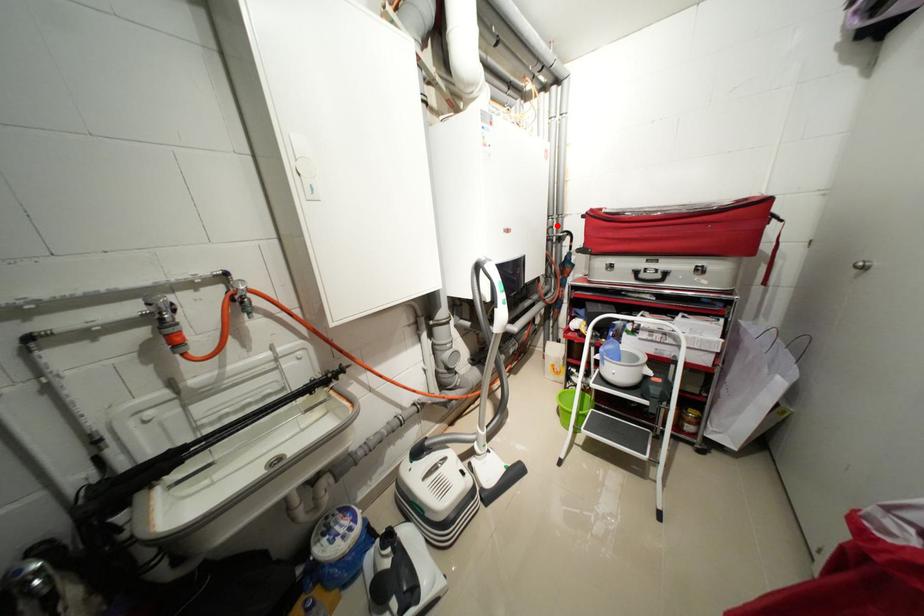
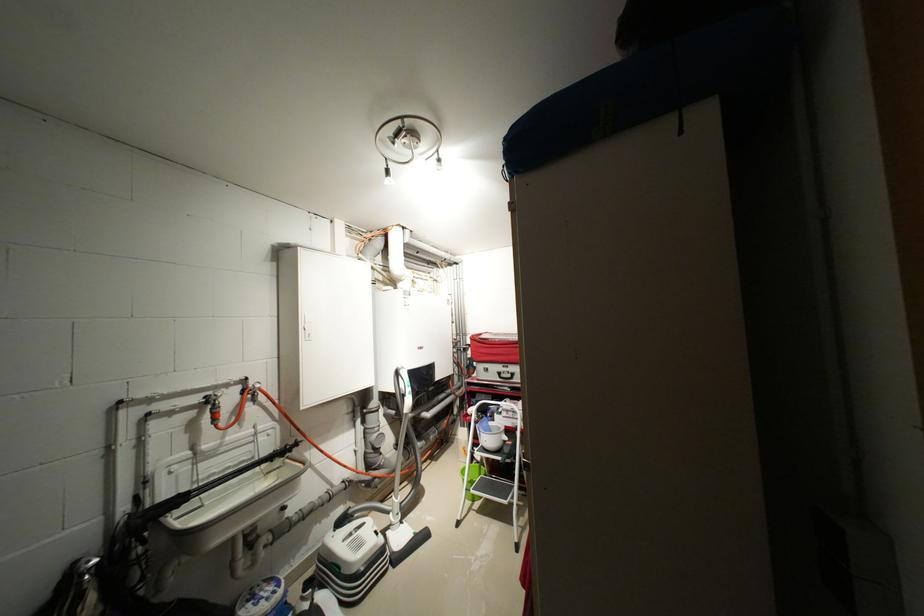
The point at the highlighted location is marked in the first image. Where is the corresponding point in the second image?

(466, 341)